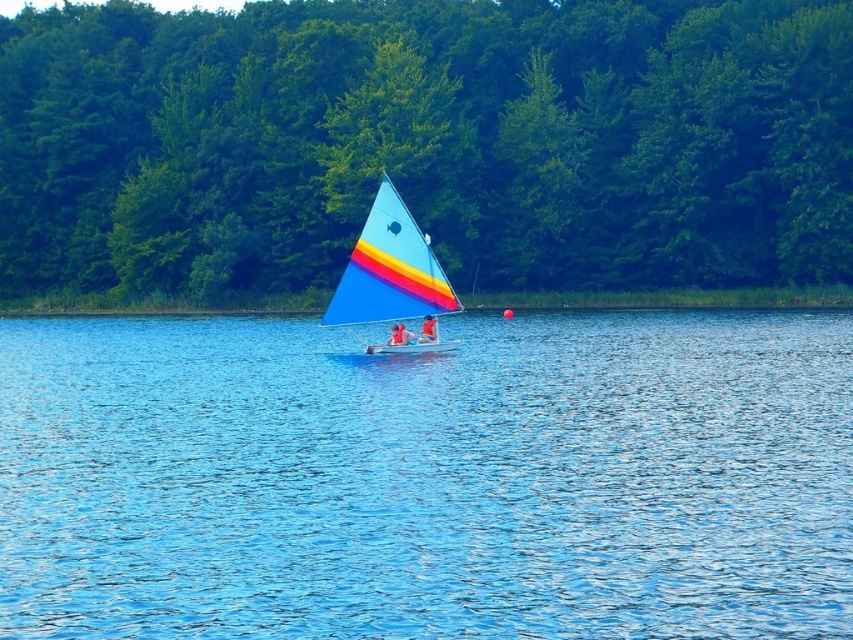
You are a drone operator trying to capture a photo of the sailboat and the green leafy trees at center. The sailboat is at point 0.122, 0.402. To ensure both are in frame, should you adjust your drone to move north or south?

The green leafy trees at center are positioned at point [427,141], while the sailboat is at [341,77]. Since the trees are north of the sailboat, moving the drone north would place both subjects in the frame.

You are standing on the deck of a cruise ship and see the point marked at point [839,572]. The cruise ship has a safety rule that states you must stay at least 50 feet away from any object or point in the water. Are you within the safe distance according to the rule?

The point marked at point [839,572] is only 44.33 feet away from you, which is less than the required 50 feet safety distance. Therefore, you are not within the safe distance according to the rule.

You are a sailor on the matte blue sailboat at center and want to reach the green leafy trees at center. Given that your sailboat can travel at a speed of 10 meters per minute, how many minutes will it take to reach the trees?

The distance between the matte blue sailboat at center and the green leafy trees at center is 41.97 meters. At a speed of 10 meters per minute, it will take approximately 4.197 minutes to reach the trees.